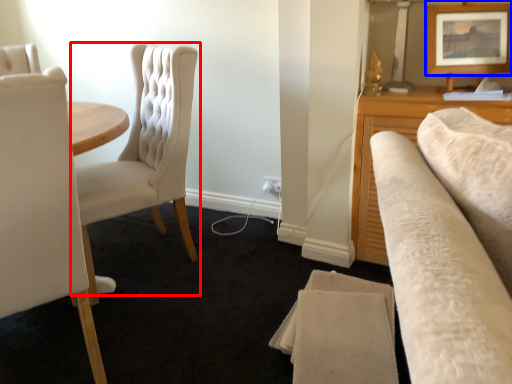
Question: Which object is closer to the camera taking this photo, chair (highlighted by a red box) or picture frame (highlighted by a blue box)?

Choices:
 (A) chair
 (B) picture frame

Answer: (A)